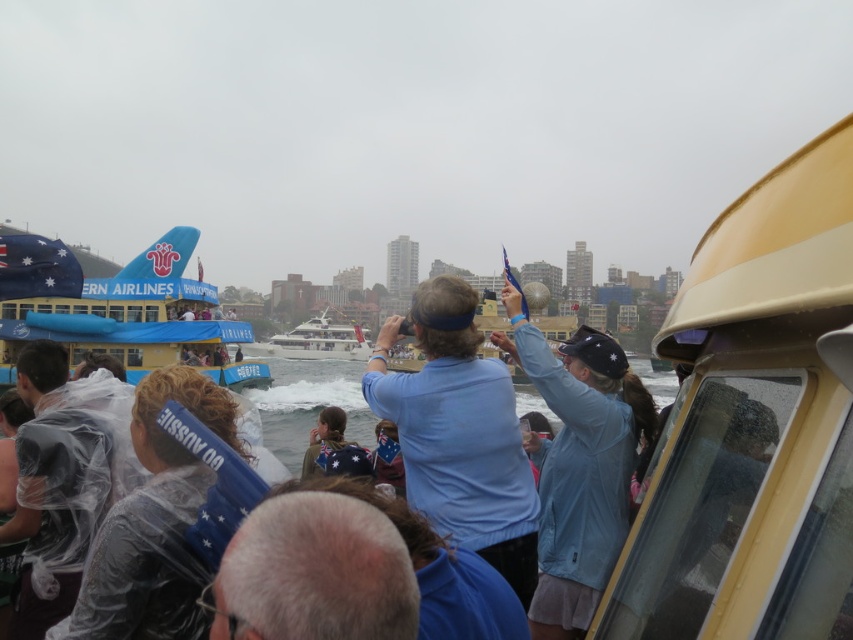
Question: Which object is the farthest from the blue fabric at center?

Choices:
 (A) blue fabric boat at upper left
 (B) light blue fabric at center

Answer: (A)

Question: Does blue fabric at center have a larger size compared to clear water at center?

Choices:
 (A) no
 (B) yes

Answer: (A)

Question: Is blue fabric at center thinner than clear water at center?

Choices:
 (A) yes
 (B) no

Answer: (A)

Question: Estimate the real-world distances between objects in this image. Which object is farther from the white glossy yacht at center?

Choices:
 (A) blue fabric at center
 (B) blue fabric boat at upper left
 (C) light blue fabric at center
 (D) clear water at center

Answer: (C)

Question: Is blue fabric at center below blue fabric boat at upper left?

Choices:
 (A) yes
 (B) no

Answer: (A)

Question: Which object is the farthest from the blue fabric boat at upper left?

Choices:
 (A) clear water at center
 (B) light blue fabric at center

Answer: (B)